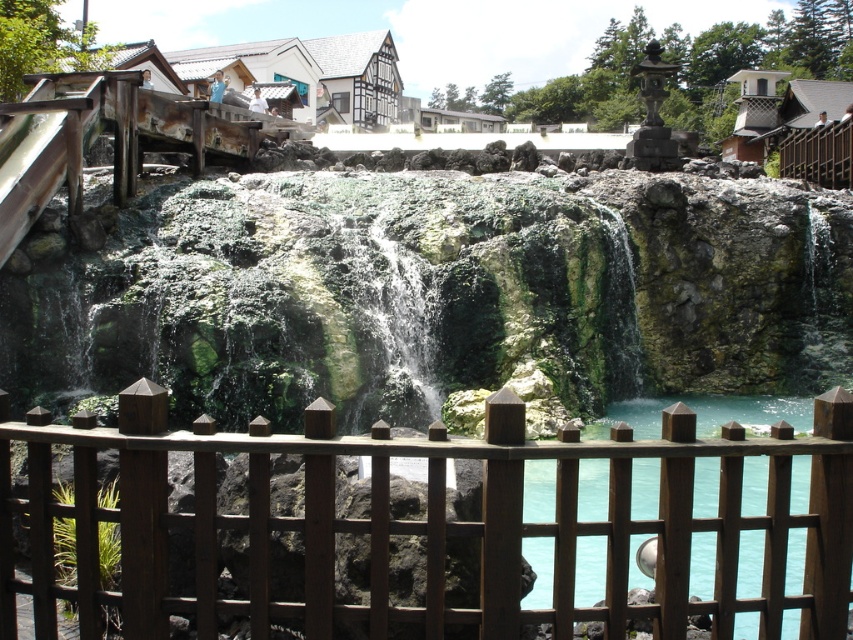
You are a painter standing at the edge of the scene. You want to capture the brown wooden fence at center and the turquoise glass water at center in your painting. Which object should you focus on first if you want to paint the larger one?

The brown wooden fence at center is bigger than turquoise glass water at center, so you should focus on painting the brown wooden fence at center first.